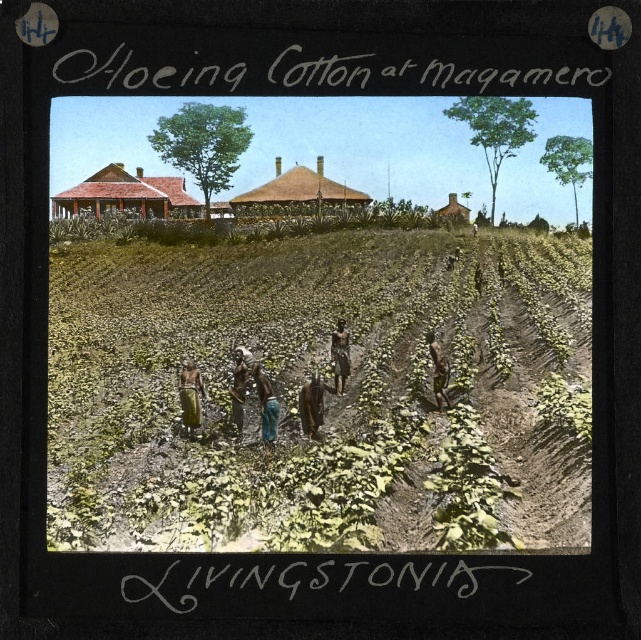
Between green fabric at center and brown leather bag at center, which one has less height?

With less height is brown leather bag at center.

Is point (181, 381) less distant than point (317, 422)?

Yes, point (181, 381) is in front of point (317, 422).

Who is more distant from viewer, [192,401] or [310,420]?

The point [310,420] is behind.

Locate an element on the screen. The width and height of the screenshot is (641, 640). green fabric at center is located at coordinates (190, 394).

Which is behind, point (238, 488) or point (338, 356)?

Positioned behind is point (338, 356).

Is point (553, 358) positioned before point (342, 385)?

Yes.

The height and width of the screenshot is (640, 641). Find the location of `green leafy plants at center`. green leafy plants at center is located at coordinates (324, 394).

Can you confirm if brown leather bag at center is shorter than brown fabric at center?

Yes, brown leather bag at center is shorter than brown fabric at center.

Between point (312, 435) and point (344, 336), which one is positioned behind?

The point (344, 336) is behind.

Locate an element on the screen. The width and height of the screenshot is (641, 640). brown leather bag at center is located at coordinates (312, 404).